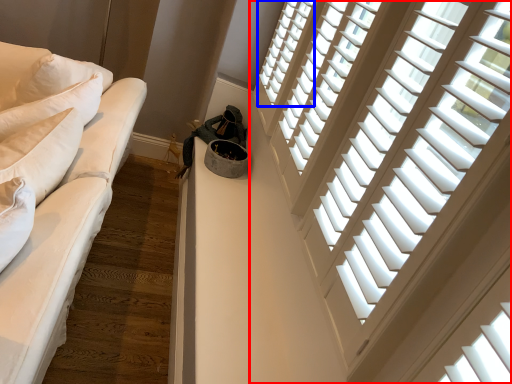
Question: Which object is closer to the camera taking this photo, window (highlighted by a red box) or window (highlighted by a blue box)?

Choices:
 (A) window
 (B) window

Answer: (A)